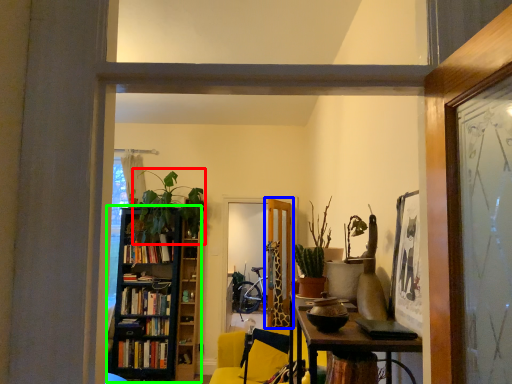
Question: Considering the real-world distances, which object is closest to plant (highlighted by a red box)? door (highlighted by a blue box) or bookcase (highlighted by a green box).

Choices:
 (A) door
 (B) bookcase

Answer: (B)